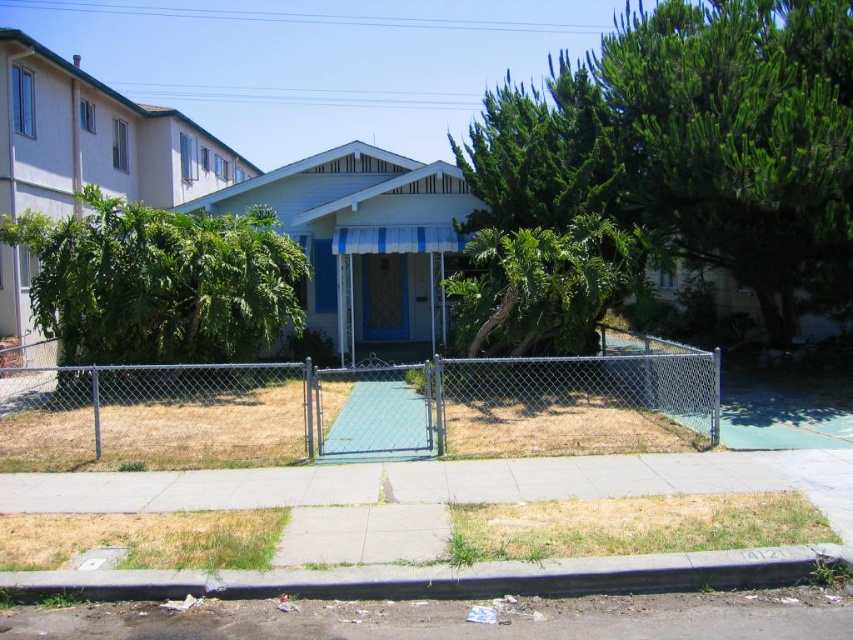
You are a delivery person trying to enter the property to deliver a package. The closed gate of the chain link fence at center is blocking your path. Can you go around the fence by using the gray concrete curb at lower center? Please explain your reasoning.

The chain link fence at center is bigger than the gray concrete curb at lower center, so the curb is smaller and likely lower than the fence. Since the fence is blocking the path, the curb might not provide a clear path around it. You may need to find another way to access the property.

You are a delivery person trying to access the house through the closed gate. The chain link fence at center has a gate that is closed. To get to the house, you need to go around the fence. Which direction should you walk to avoid the gray concrete curb at lower center?

The chain link fence at center is wider than the gray concrete curb at lower center, so you should walk along the side of the chain link fence at center to avoid the gray concrete curb at lower center.

You are standing outside the house and want to enter through the gate. Based on the coordinates provided, can you determine the direction you should walk to reach the chain link fence at center?

The chain link fence at center is located at coordinates point (x=360, y=408), so you should walk towards the center of the image to reach it.